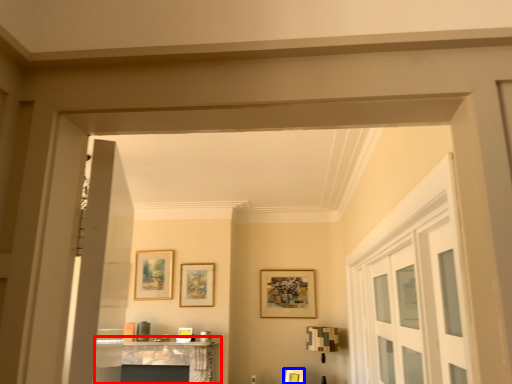
Question: Which object is further to the camera taking this photo, table (highlighted by a red box) or picture frame (highlighted by a blue box)?

Choices:
 (A) table
 (B) picture frame

Answer: (B)